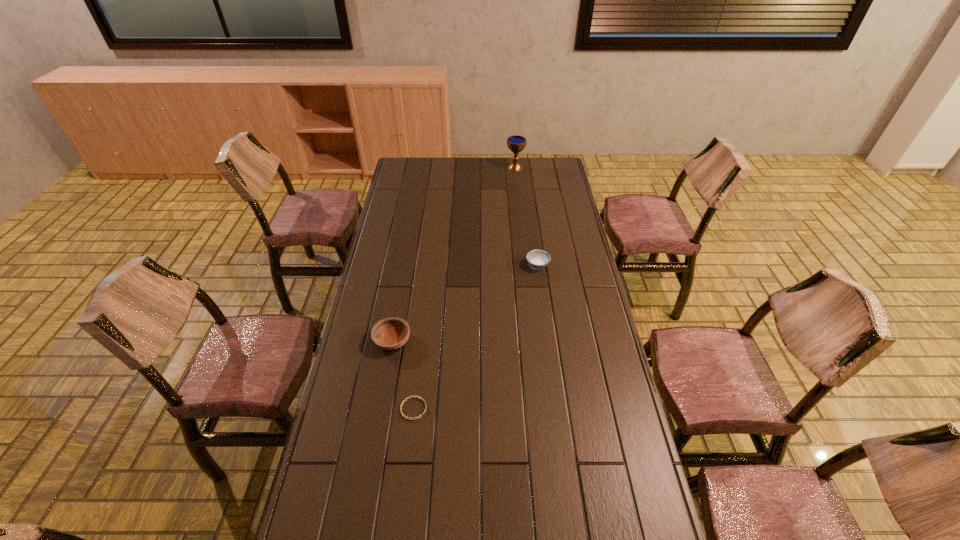
This screenshot has width=960, height=540. I want to click on the tallest object, so click(x=516, y=143).

This screenshot has width=960, height=540. I want to click on the farthest object, so click(x=516, y=143).

Identify the location of the second tallest object. This screenshot has height=540, width=960. (392, 333).

Image resolution: width=960 pixels, height=540 pixels. What are the coordinates of `bowl` in the screenshot? It's located at (392, 333).

This screenshot has height=540, width=960. Identify the location of the second farthest object. (537, 259).

Where is `ashtray`? ashtray is located at coordinates (537, 259).

Locate an element on the screen. Image resolution: width=960 pixels, height=540 pixels. the shortest object is located at coordinates [403, 415].

Find the location of a particular element. The image size is (960, 540). the nearest object is located at coordinates (403, 415).

Where is `free point located on the front of the farthest object`? The width and height of the screenshot is (960, 540). free point located on the front of the farthest object is located at coordinates pyautogui.click(x=518, y=196).

You are a GUI agent. You are given a task and a screenshot of the screen. Output one action in this format:
    pyautogui.click(x=<x>, y=<y>)
    Task: Click on the vacant space located 0.060m on the left of the bowl
    This screenshot has width=960, height=540.
    Given the screenshot: What is the action you would take?
    pyautogui.click(x=356, y=341)